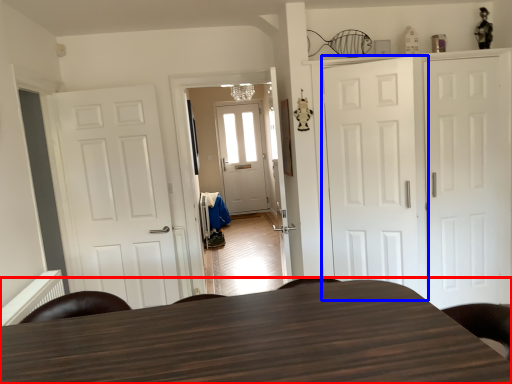
Question: Which object is closer to the camera taking this photo, table (highlighted by a red box) or door (highlighted by a blue box)?

Choices:
 (A) table
 (B) door

Answer: (A)